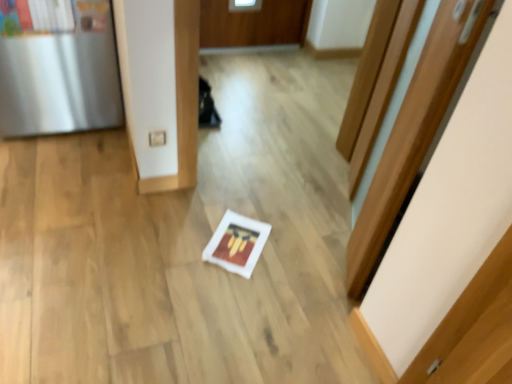
Question: Does white matte frame at center turn towards satin silver fridge at left?

Choices:
 (A) yes
 (B) no

Answer: (B)

Question: From a real-world perspective, is white matte frame at center positioned under satin silver fridge at left based on gravity?

Choices:
 (A) no
 (B) yes

Answer: (B)

Question: Is white matte frame at center closer to the viewer compared to satin silver fridge at left?

Choices:
 (A) yes
 (B) no

Answer: (B)

Question: Can you confirm if white matte frame at center is shorter than satin silver fridge at left?

Choices:
 (A) no
 (B) yes

Answer: (B)

Question: Is white matte frame at center oriented away from satin silver fridge at left?

Choices:
 (A) no
 (B) yes

Answer: (A)

Question: Considering the positions of satin silver fridge at left and wooden door at center in the image, is satin silver fridge at left wider or thinner than wooden door at center?

Choices:
 (A) wide
 (B) thin

Answer: (A)

Question: From the image's perspective, is satin silver fridge at left positioned above or below wooden door at center?

Choices:
 (A) above
 (B) below

Answer: (A)

Question: Is satin silver fridge at left bigger or smaller than wooden door at center?

Choices:
 (A) small
 (B) big

Answer: (B)

Question: Does point (14, 48) appear closer or farther from the camera than point (377, 349)?

Choices:
 (A) farther
 (B) closer

Answer: (A)

Question: In the image, is wooden door at center positioned in front of or behind white matte frame at center?

Choices:
 (A) front
 (B) behind

Answer: (A)

Question: Is point (432, 354) closer or farther from the camera than point (245, 221)?

Choices:
 (A) closer
 (B) farther

Answer: (A)

Question: From their relative heights in the image, would you say wooden door at center is taller or shorter than white matte frame at center?

Choices:
 (A) tall
 (B) short

Answer: (A)

Question: From the image's perspective, is wooden door at center positioned above or below white matte frame at center?

Choices:
 (A) above
 (B) below

Answer: (A)

Question: In terms of width, does white matte frame at center look wider or thinner when compared to satin silver fridge at left?

Choices:
 (A) thin
 (B) wide

Answer: (A)

Question: From their relative heights in the image, would you say white matte frame at center is taller or shorter than satin silver fridge at left?

Choices:
 (A) tall
 (B) short

Answer: (B)